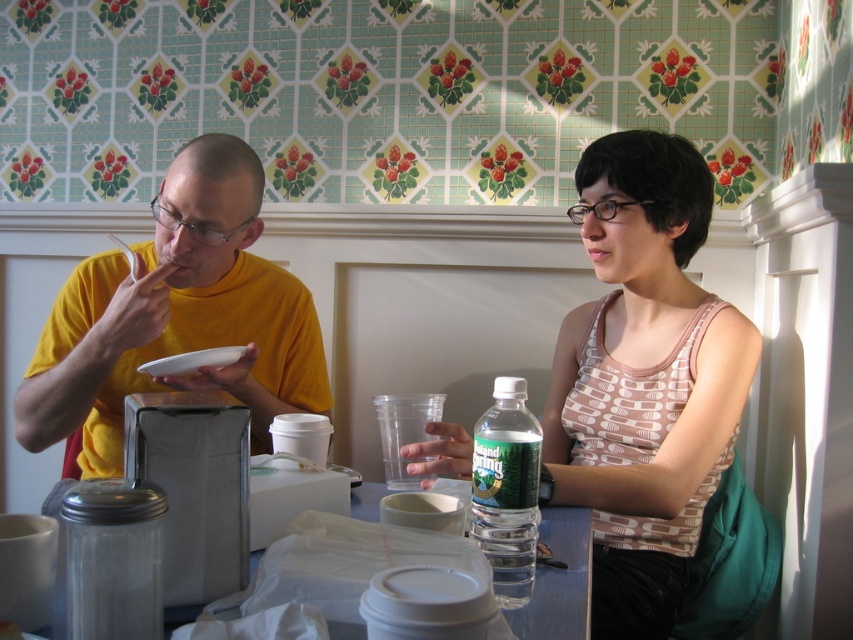
Is point (694, 244) positioned before point (219, 348)?

No, it is behind (219, 348).

Can you confirm if matte yellow shirt at left is positioned above white matte plate at upper left?

Yes, matte yellow shirt at left is above white matte plate at upper left.

Does point (717, 396) come closer to viewer compared to point (181, 371)?

Yes.

Where is `matte yellow shirt at left`? matte yellow shirt at left is located at coordinates (643, 380).

Can you confirm if matte yellow shirt at left is wider than patterned fabric tank top at center?

No, matte yellow shirt at left is not wider than patterned fabric tank top at center.

Identify the location of matte yellow shirt at left. (643, 380).

At what (x,y) coordinates should I click in order to perform the action: click on matte yellow shirt at left. Please return your answer as a coordinate pair (x, y). Image resolution: width=853 pixels, height=640 pixels. Looking at the image, I should click on click(643, 380).

Can you confirm if yellow matte shirt at left is shorter than clear plastic water bottle at lower center?

Incorrect, yellow matte shirt at left's height does not fall short of clear plastic water bottle at lower center's.

Between yellow matte shirt at left and clear plastic water bottle at lower center, which one has more height?

With more height is yellow matte shirt at left.

Who is more forward, (202, 387) or (492, 419)?

Positioned in front is point (492, 419).

The image size is (853, 640). In order to click on yellow matte shirt at left in this screenshot , I will do `click(177, 316)`.